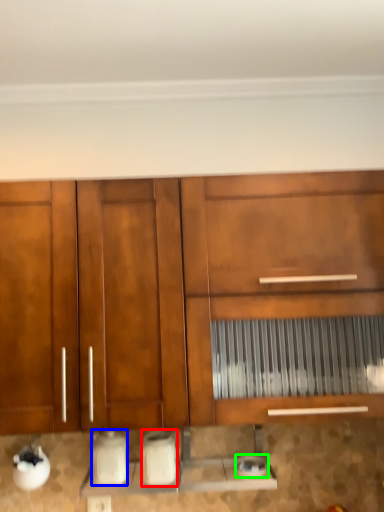
Question: Which object is the closest to the appliance (highlighted by a red box)? Choose among these: appliance (highlighted by a blue box) or appliance (highlighted by a green box).

Choices:
 (A) appliance
 (B) appliance

Answer: (A)